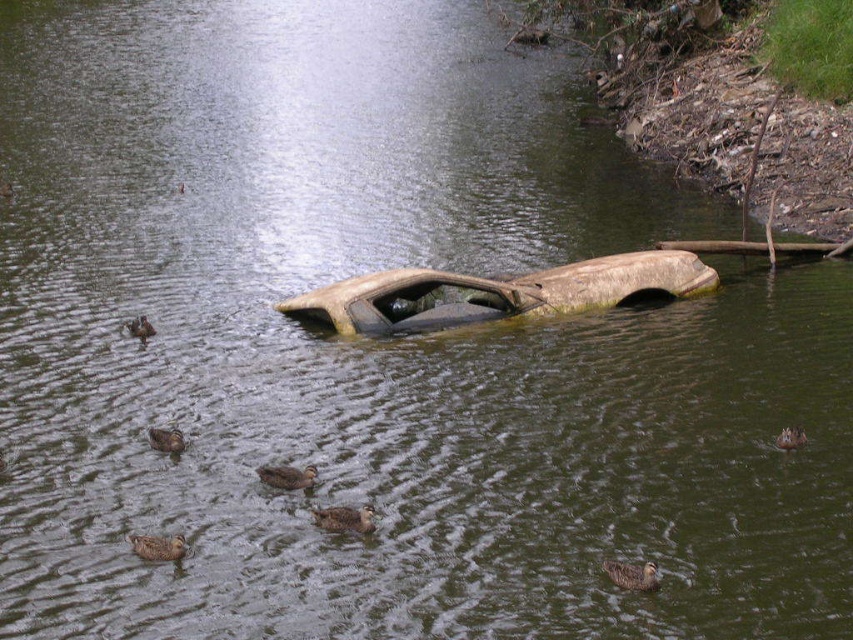
You are standing on the bank of the river where the brown fuzzy duck at center is swimming. If you want to throw a stick to the duck, but you can only throw 10 meters, will you be able to reach it?

The brown fuzzy duck at center is 13.82 meters away, so you cannot reach it with a 10 meter throw.

You are a photographer trying to capture the brown matte duck at center in the scene. The camera is set to focus at point coordinates of 0.745, 0.338. Will the duck be in focus?

Yes, the brown matte duck at center is exactly at point coordinates of (287,476), so the camera will focus on it.